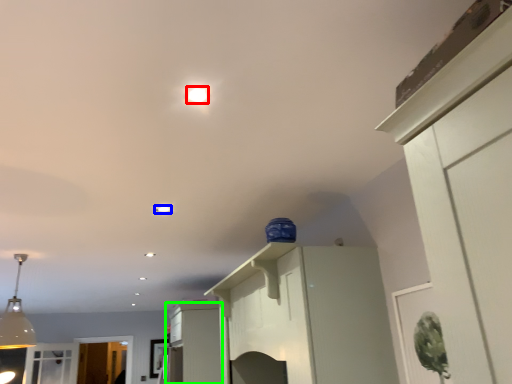
Question: Considering the real-world distances, which object is closest to lighting (highlighted by a red box)? light (highlighted by a blue box) or cabinetry (highlighted by a green box).

Choices:
 (A) light
 (B) cabinetry

Answer: (A)